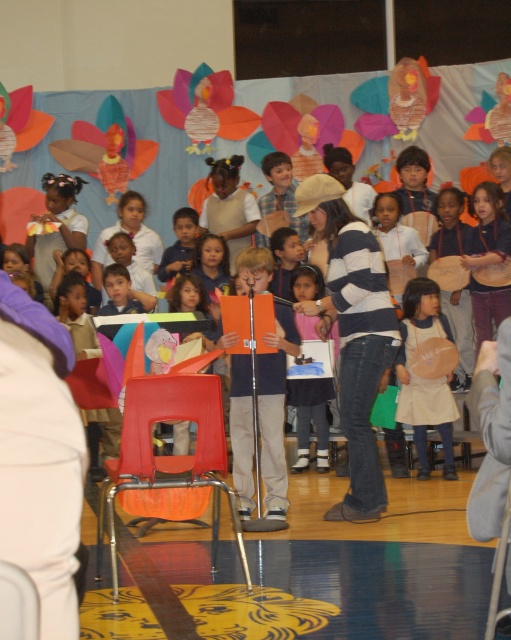
Which of these two, beige fabric apron at center or pink fabric dress at center, stands shorter?

pink fabric dress at center is shorter.

Which is more to the right, beige fabric apron at center or pink fabric dress at center?

Positioned to the right is beige fabric apron at center.

Does point (453, 468) lie behind point (309, 380)?

No, (453, 468) is in front of (309, 380).

Image resolution: width=511 pixels, height=640 pixels. What are the coordinates of `beige fabric apron at center` in the screenshot? It's located at (424, 378).

Does striped sweater at center have a lesser width compared to beige fabric apron at center?

In fact, striped sweater at center might be wider than beige fabric apron at center.

Is striped sweater at center behind beige fabric apron at center?

No, it is not.

Describe the element at coordinates (353, 333) in the screenshot. I see `striped sweater at center` at that location.

Image resolution: width=511 pixels, height=640 pixels. Find the location of `striped sweater at center`. striped sweater at center is located at coordinates (353, 333).

Between striped sweater at center and pink fabric dress at center, which one is positioned higher?

striped sweater at center

From the picture: Does striped sweater at center have a lesser width compared to pink fabric dress at center?

No.

Identify the location of striped sweater at center. (353, 333).

The image size is (511, 640). I want to click on striped sweater at center, so click(353, 333).